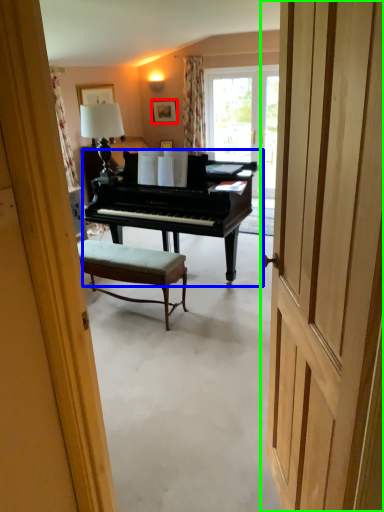
Question: Based on their relative distances, which object is nearer to picture frame (highlighted by a red box)? Choose from piano (highlighted by a blue box) and door (highlighted by a green box).

Choices:
 (A) piano
 (B) door

Answer: (A)